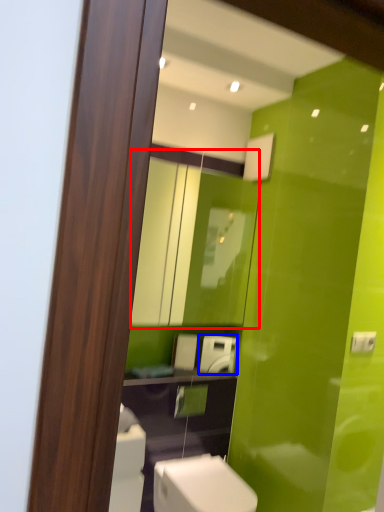
Question: Among these objects, which one is nearest to the camera, mirror (highlighted by a red box) or appliance (highlighted by a blue box)?

Choices:
 (A) mirror
 (B) appliance

Answer: (A)